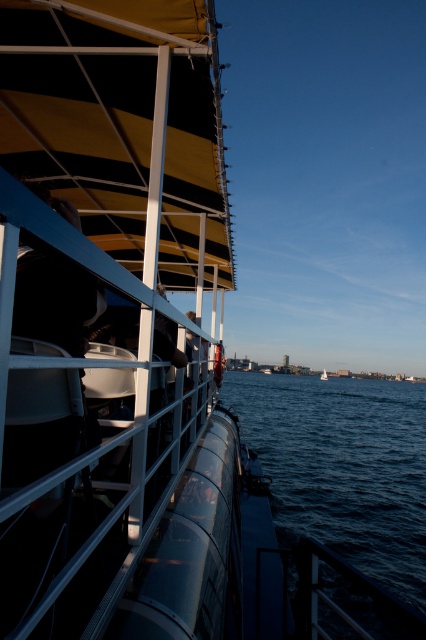
Does dark blue water at lower right have a lesser width compared to white glossy sailboat at center?

In fact, dark blue water at lower right might be wider than white glossy sailboat at center.

Is dark blue water at lower right shorter than white glossy sailboat at center?

In fact, dark blue water at lower right may be taller than white glossy sailboat at center.

Identify the location of dark blue water at lower right. 344,465.

Find the location of a particular element. dark blue water at lower right is located at coordinates (344, 465).